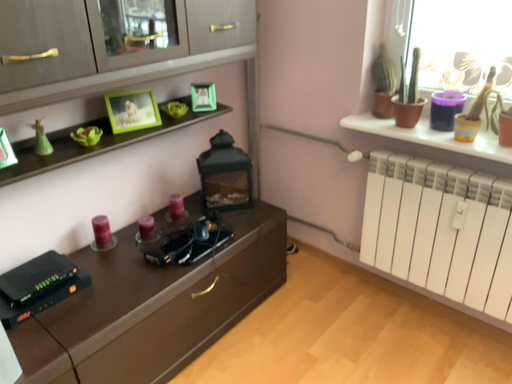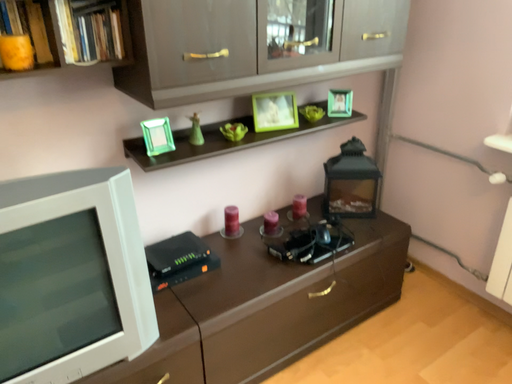
Question: How did the camera likely rotate when shooting the video?

Choices:
 (A) rotated right
 (B) rotated left

Answer: (B)